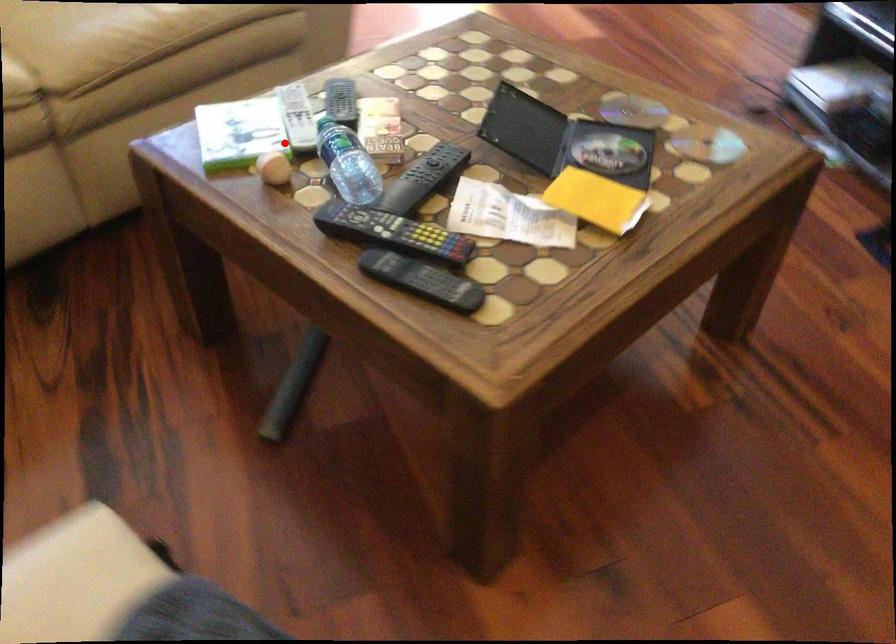
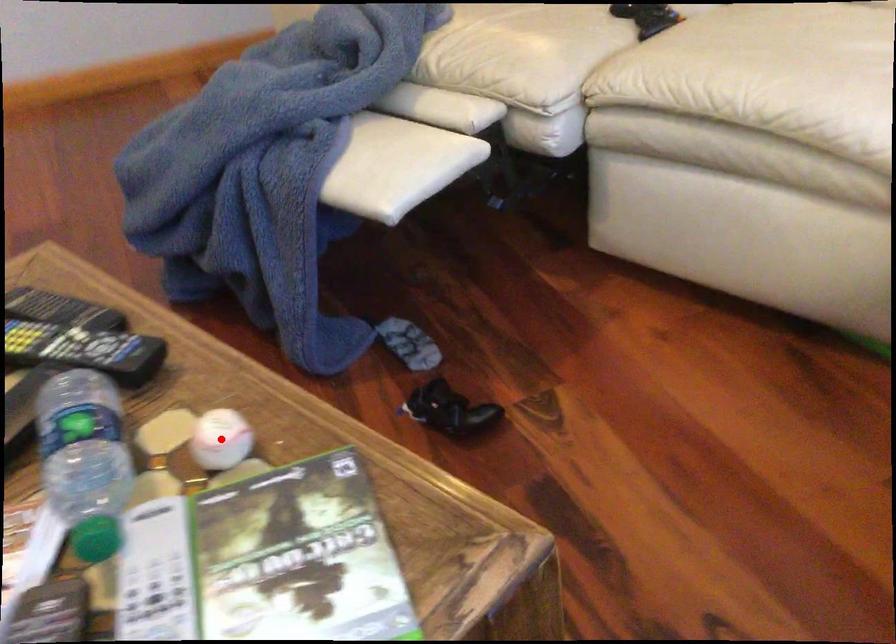
I am providing you with two images of the same scene from different viewpoints. A red point is marked on the first image and another point is marked on the second image. Do the highlighted points in image1 and image2 indicate the same real-world spot?

Yes